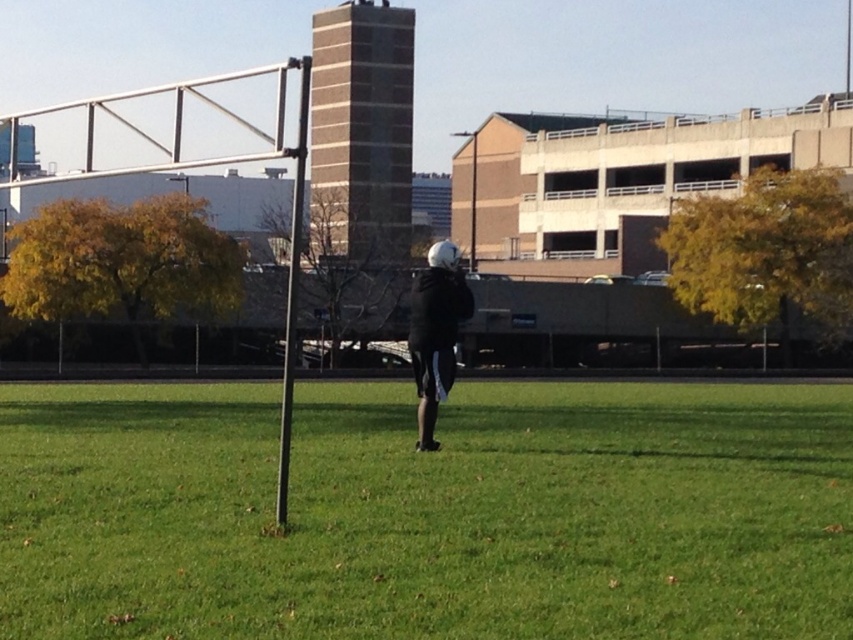
You are a drone operator trying to capture a photo of the black matte jacket at center and the green grass at center from above. What is the minimum distance the drone needs to fly to ensure both objects are fully visible in the frame?

The minimum distance the drone needs to fly is 13.07 feet to ensure both the green grass at center and the black matte jacket at center are fully visible in the frame since they are 13.07 feet apart from each other.

You are standing at the point labeled as point (x=427, y=513) in the image. What object is located exactly at that coordinate?

The point (x=427, y=513) corresponds to green grass at center.